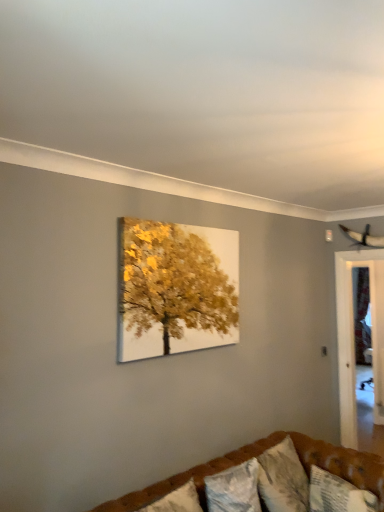
Locate an element on the screen. The width and height of the screenshot is (384, 512). textured white pillow at lower right, which appears as the first pillow when viewed from the right is located at coordinates (338, 494).

You are a GUI agent. You are given a task and a screenshot of the screen. Output one action in this format:
    pyautogui.click(x=<x>, y=<y>)
    Task: Click on the brown tufted couch at lower center
    The image size is (384, 512).
    Given the screenshot: What is the action you would take?
    pyautogui.click(x=257, y=456)

The width and height of the screenshot is (384, 512). Identify the location of textured white pillow at lower center, arranged as the 2th pillow when viewed from the right. (234, 489).

Can transparent glass door at right be found inside textured white pillow at lower center, arranged as the 2th pillow when viewed from the right?

Actually, transparent glass door at right is outside textured white pillow at lower center, arranged as the 2th pillow when viewed from the right.

How different are the orientations of textured white pillow at lower center, positioned as the 1th pillow in left-to-right order, and transparent glass door at right in degrees?

The angle between the facing direction of textured white pillow at lower center, positioned as the 1th pillow in left-to-right order, and the facing direction of transparent glass door at right is 88.3 degrees.

Who is bigger, textured white pillow at lower center, arranged as the 2th pillow when viewed from the right, or transparent glass door at right?

With larger size is transparent glass door at right.

In the scene shown: Is textured white pillow at lower center, positioned as the 1th pillow in left-to-right order, turned away from transparent glass door at right?

No, transparent glass door at right is not at the back of textured white pillow at lower center, positioned as the 1th pillow in left-to-right order.

From the picture: Measure the distance from transparent glass door at right to textured white pillow at lower center, arranged as the 2th pillow when viewed from the right.

transparent glass door at right is 1.99 meters from textured white pillow at lower center, arranged as the 2th pillow when viewed from the right.

At what (x,y) coordinates should I click in order to perform the action: click on glass door above the textured white pillow at lower center, positioned as the 1th pillow in left-to-right order (from the image's perspective). Please return your answer as a coordinate pair (x, y). This screenshot has height=512, width=384. Looking at the image, I should click on (353, 336).

In the scene shown: Is transparent glass door at right shorter than textured white pillow at lower center, positioned as the 1th pillow in left-to-right order?

Incorrect, the height of transparent glass door at right does not fall short of that of textured white pillow at lower center, positioned as the 1th pillow in left-to-right order.

Are transparent glass door at right and textured white pillow at lower center, arranged as the 2th pillow when viewed from the right, beside each other?

No, transparent glass door at right is not making contact with textured white pillow at lower center, arranged as the 2th pillow when viewed from the right.

From the image's perspective, would you say textured white pillow at lower right, the 2th pillow viewed from the left, is positioned over textured white pillow at lower center, positioned as the 1th pillow in left-to-right order?

No, from the image's perspective, textured white pillow at lower right, the 2th pillow viewed from the left, is not on top of textured white pillow at lower center, positioned as the 1th pillow in left-to-right order.

Does textured white pillow at lower right, which appears as the first pillow when viewed from the right, have a greater height compared to textured white pillow at lower center, positioned as the 1th pillow in left-to-right order?

Indeed, textured white pillow at lower right, which appears as the first pillow when viewed from the right, has a greater height compared to textured white pillow at lower center, positioned as the 1th pillow in left-to-right order.

Is point (312, 466) in front of point (243, 467)?

No, (312, 466) is behind (243, 467).

From the image's perspective, is brown tufted couch at lower center positioned above or below transparent glass door at right?

Clearly, from the image's perspective, brown tufted couch at lower center is below transparent glass door at right.

From a real-world perspective, which object rests below the other?

brown tufted couch at lower center, from a real-world perspective.

Is brown tufted couch at lower center not near transparent glass door at right?

brown tufted couch at lower center is positioned a significant distance from transparent glass door at right.

Considering their positions, is transparent glass door at right located in front of or behind brown tufted couch at lower center?

transparent glass door at right is positioned farther from the viewer than brown tufted couch at lower center.

Does transparent glass door at right have a lesser width compared to brown tufted couch at lower center?

Yes, transparent glass door at right is thinner than brown tufted couch at lower center.

Would you say transparent glass door at right is inside or outside brown tufted couch at lower center?

transparent glass door at right is outside brown tufted couch at lower center.

In terms of height, does transparent glass door at right look taller or shorter compared to brown tufted couch at lower center?

Clearly, transparent glass door at right is taller compared to brown tufted couch at lower center.

Is textured white pillow at lower center, arranged as the 2th pillow when viewed from the right, turned away from textured white pillow at lower right, the 2th pillow viewed from the left?

textured white pillow at lower center, arranged as the 2th pillow when viewed from the right, is not turned away from textured white pillow at lower right, the 2th pillow viewed from the left.

From the image's perspective, which is above, textured white pillow at lower center, arranged as the 2th pillow when viewed from the right, or textured white pillow at lower right, which appears as the first pillow when viewed from the right?

textured white pillow at lower center, arranged as the 2th pillow when viewed from the right, is shown above in the image.

From a real-world perspective, between textured white pillow at lower center, arranged as the 2th pillow when viewed from the right, and textured white pillow at lower right, the 2th pillow viewed from the left, who is vertically lower?

textured white pillow at lower right, the 2th pillow viewed from the left.

Is point (319, 505) farther from viewer compared to point (319, 447)?

No, it is in front of (319, 447).

Consider the image. Could you tell me if textured white pillow at lower right, the 2th pillow viewed from the left, is facing brown tufted couch at lower center?

Yes, textured white pillow at lower right, the 2th pillow viewed from the left, is turned towards brown tufted couch at lower center.

Is textured white pillow at lower right, which appears as the first pillow when viewed from the right, not inside brown tufted couch at lower center?

No.

Identify the location of glass door above the textured white pillow at lower center, arranged as the 2th pillow when viewed from the right (from a real-world perspective). The width and height of the screenshot is (384, 512). (353, 336).

This screenshot has width=384, height=512. Find the location of `the 1st pillow below when counting from the transparent glass door at right (from the image's perspective)`. the 1st pillow below when counting from the transparent glass door at right (from the image's perspective) is located at coordinates click(234, 489).

Based on their spatial positions, is brown tufted couch at lower center or transparent glass door at right further from textured white pillow at lower right, the 2th pillow viewed from the left?

The object further to textured white pillow at lower right, the 2th pillow viewed from the left, is transparent glass door at right.

Looking at the image, which one is located closer to brown tufted couch at lower center, transparent glass door at right or textured white pillow at lower center, positioned as the 1th pillow in left-to-right order?

Among the two, textured white pillow at lower center, positioned as the 1th pillow in left-to-right order, is located nearer to brown tufted couch at lower center.

When comparing their distances from textured white pillow at lower right, the 2th pillow viewed from the left, does brown tufted couch at lower center or textured white pillow at lower center, positioned as the 1th pillow in left-to-right order, seem closer?

brown tufted couch at lower center.

Which object lies nearer to the anchor point textured white pillow at lower right, the 2th pillow viewed from the left, transparent glass door at right or brown tufted couch at lower center?

brown tufted couch at lower center is positioned closer to the anchor textured white pillow at lower right, the 2th pillow viewed from the left.

Based on their spatial positions, is textured white pillow at lower center, arranged as the 2th pillow when viewed from the right, or textured white pillow at lower right, which appears as the first pillow when viewed from the right, further from brown tufted couch at lower center?

Among the two, textured white pillow at lower right, which appears as the first pillow when viewed from the right, is located further to brown tufted couch at lower center.

Which object lies further to the anchor point textured white pillow at lower center, positioned as the 1th pillow in left-to-right order, brown tufted couch at lower center or textured white pillow at lower right, which appears as the first pillow when viewed from the right?

The object further to textured white pillow at lower center, positioned as the 1th pillow in left-to-right order, is textured white pillow at lower right, which appears as the first pillow when viewed from the right.

When comparing their distances from textured white pillow at lower center, arranged as the 2th pillow when viewed from the right, does textured white pillow at lower right, the 2th pillow viewed from the left, or brown tufted couch at lower center seem closer?

brown tufted couch at lower center lies closer to textured white pillow at lower center, arranged as the 2th pillow when viewed from the right, than the other object.

Looking at the image, which one is located closer to brown tufted couch at lower center, transparent glass door at right or textured white pillow at lower right, which appears as the first pillow when viewed from the right?

textured white pillow at lower right, which appears as the first pillow when viewed from the right.

At what (x,y) coordinates should I click in order to perform the action: click on pillow between brown tufted couch at lower center and textured white pillow at lower right, which appears as the first pillow when viewed from the right, along the z-axis. Please return your answer as a coordinate pair (x, y). Looking at the image, I should click on (234, 489).

Locate an element on the screen. Image resolution: width=384 pixels, height=512 pixels. pillow between textured white pillow at lower center, arranged as the 2th pillow when viewed from the right, and transparent glass door at right in the front-back direction is located at coordinates (338, 494).